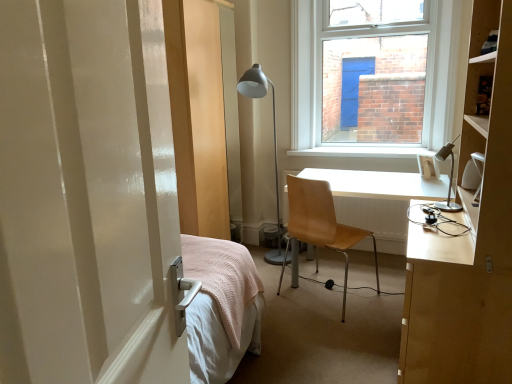
Question: Considering the relative sizes of silver metallic desk lamp at right, which is counted as the first lamp, starting from the right, and white plastic picture frame at upper right in the image provided, is silver metallic desk lamp at right, which is counted as the first lamp, starting from the right, smaller than white plastic picture frame at upper right?

Choices:
 (A) no
 (B) yes

Answer: (A)

Question: From a real-world perspective, is silver metallic desk lamp at right, placed as the second lamp when sorted from back to front, below white plastic picture frame at upper right?

Choices:
 (A) yes
 (B) no

Answer: (B)

Question: Can you confirm if silver metallic desk lamp at right, which is counted as the first lamp, starting from the right, is wider than white plastic picture frame at upper right?

Choices:
 (A) no
 (B) yes

Answer: (B)

Question: Does silver metallic desk lamp at right, which appears as the first lamp when viewed from the front, have a larger size compared to white plastic picture frame at upper right?

Choices:
 (A) no
 (B) yes

Answer: (B)

Question: From the image's perspective, is silver metallic desk lamp at right, which is counted as the first lamp, starting from the right, on white plastic picture frame at upper right?

Choices:
 (A) no
 (B) yes

Answer: (A)

Question: From a real-world perspective, is silver metallic desk lamp at right, which is counted as the first lamp, starting from the right, positioned over white plastic picture frame at upper right based on gravity?

Choices:
 (A) no
 (B) yes

Answer: (B)

Question: Considering the relative sizes of white plastic picture frame at upper right and light brown wood desk at center right in the image provided, is white plastic picture frame at upper right taller than light brown wood desk at center right?

Choices:
 (A) no
 (B) yes

Answer: (A)

Question: Is the position of white plastic picture frame at upper right more distant than that of light brown wood desk at center right?

Choices:
 (A) yes
 (B) no

Answer: (A)

Question: Are white plastic picture frame at upper right and light brown wood desk at center right beside each other?

Choices:
 (A) yes
 (B) no

Answer: (B)

Question: Is white plastic picture frame at upper right positioned far away from light brown wood desk at center right?

Choices:
 (A) no
 (B) yes

Answer: (A)

Question: Can you confirm if white plastic picture frame at upper right is positioned to the right of light brown wood desk at center right?

Choices:
 (A) yes
 (B) no

Answer: (A)

Question: From the image's perspective, is white plastic picture frame at upper right beneath light brown wood desk at center right?

Choices:
 (A) no
 (B) yes

Answer: (A)

Question: From the image's perspective, is white plastic picture frame at upper right under silver metallic desk lamp at right, the second lamp in the left-to-right sequence?

Choices:
 (A) yes
 (B) no

Answer: (B)